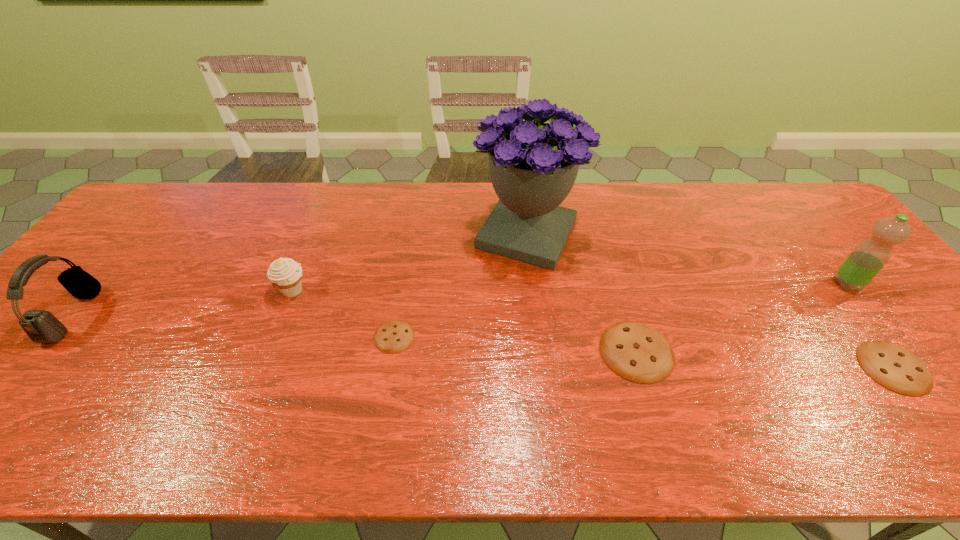
Where is `the fifth object from right to left`? The width and height of the screenshot is (960, 540). the fifth object from right to left is located at coordinates (395, 336).

The image size is (960, 540). What are the coordinates of `the leftmost cookie` in the screenshot? It's located at (395, 336).

The height and width of the screenshot is (540, 960). Identify the location of the second cookie from right to left. (636, 352).

Where is `the rightmost cookie`? This screenshot has height=540, width=960. the rightmost cookie is located at coordinates (895, 368).

Where is `the sixth tallest object`? The image size is (960, 540). the sixth tallest object is located at coordinates (895, 368).

Locate an element on the screen. This screenshot has height=540, width=960. water bottle is located at coordinates (869, 256).

This screenshot has width=960, height=540. What are the coordinates of `the farthest object` in the screenshot? It's located at (533, 165).

The height and width of the screenshot is (540, 960). What are the coordinates of `the tallest object` in the screenshot? It's located at (533, 165).

Identify the location of the second object from left to right. (285, 274).

This screenshot has height=540, width=960. I want to click on muffin, so click(285, 274).